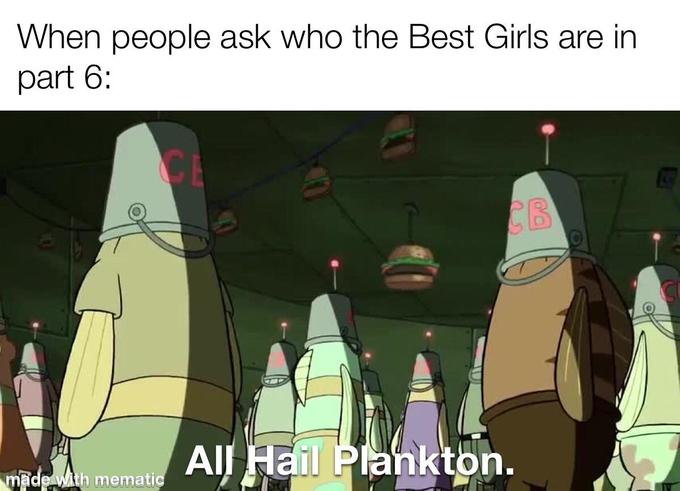
In order to click on bucket in this screenshot , I will do pos(29,361), pos(283,369), pos(322,323), pos(421,375), pos(476,364), pos(659,307), pos(564,202), pos(370,383).